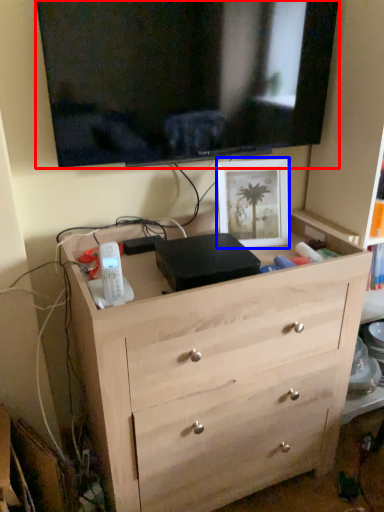
Question: Which object is closer to the camera taking this photo, television (highlighted by a red box) or picture frame (highlighted by a blue box)?

Choices:
 (A) television
 (B) picture frame

Answer: (A)